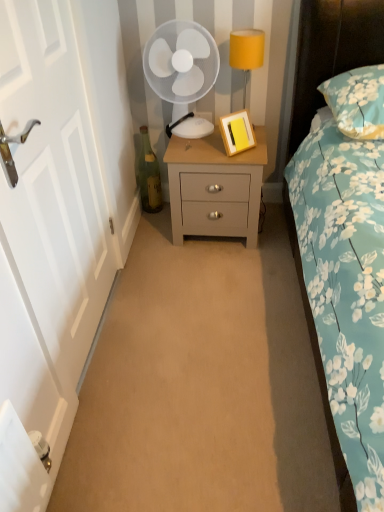
Question: From the image's perspective, is white plastic fan at upper center positioned above or below floral fabric pillow at upper right?

Choices:
 (A) below
 (B) above

Answer: (B)

Question: Visually, is white plastic fan at upper center positioned to the left or to the right of floral fabric pillow at upper right?

Choices:
 (A) left
 (B) right

Answer: (A)

Question: Based on their relative distances, which object is farther from the light gray wood nightstand at center?

Choices:
 (A) yellow fabric lampshade at upper right
 (B) white painted wood door at left
 (C) floral fabric pillow at upper right
 (D) white plastic fan at upper center
 (E) yellow matte picture frame at center

Answer: (B)

Question: Estimate the real-world distances between objects in this image. Which object is closer to the floral fabric pillow at upper right?

Choices:
 (A) green glass bottle at lower left
 (B) yellow fabric lampshade at upper right
 (C) light gray wood nightstand at center
 (D) white plastic fan at upper center
 (E) white painted wood door at left

Answer: (B)